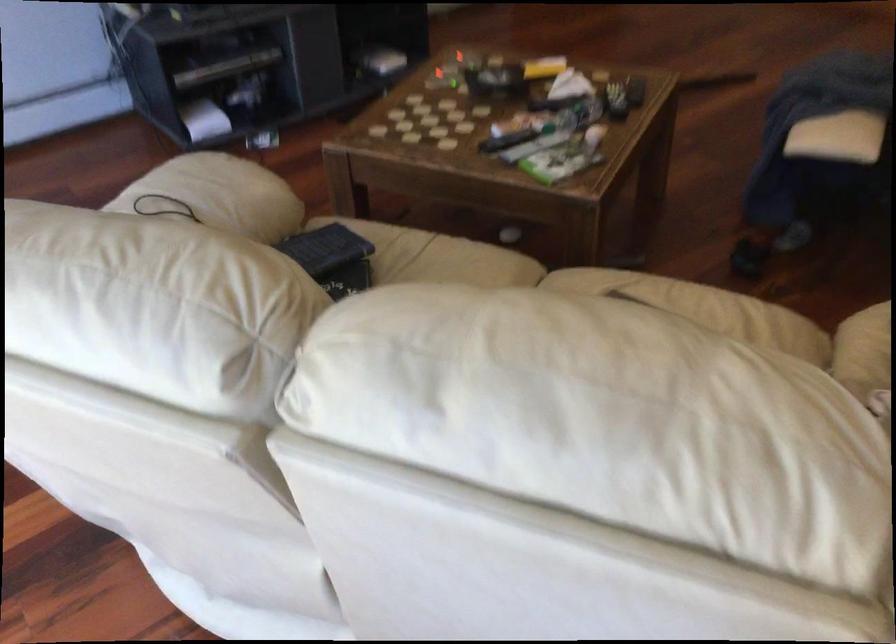
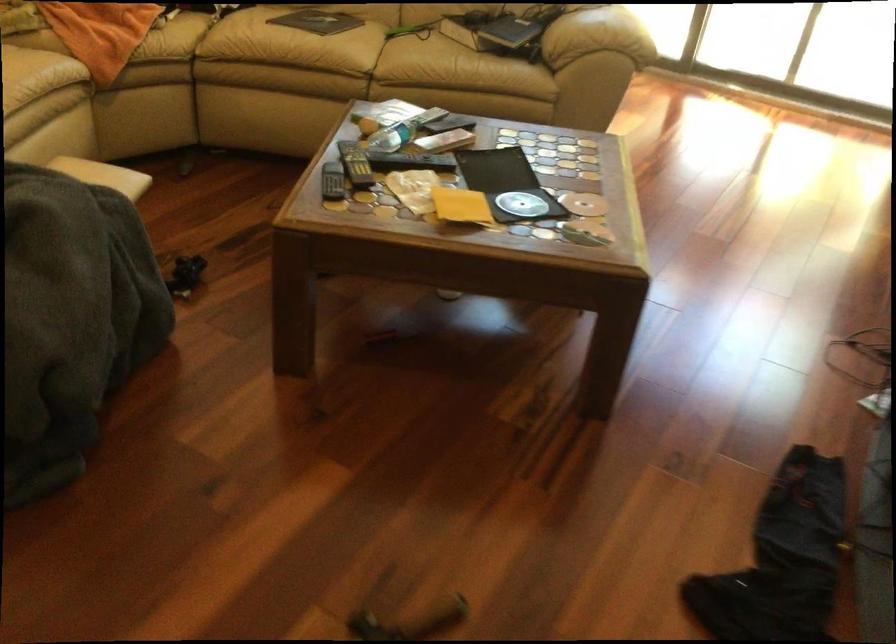
In the second image, find the point that corresponds to [600,275] in the first image.

(334, 58)